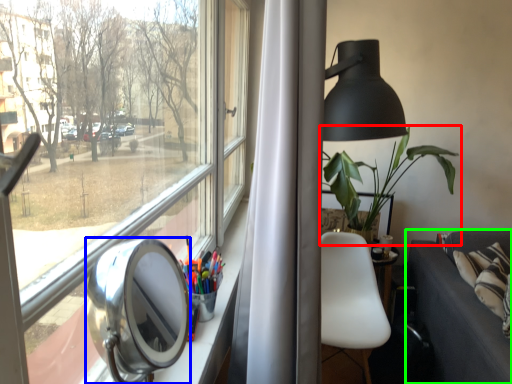
Question: Which is farther away from houseplant (highlighted by a red box)? view mirror (highlighted by a blue box) or studio couch (highlighted by a green box)?

Choices:
 (A) view mirror
 (B) studio couch

Answer: (A)